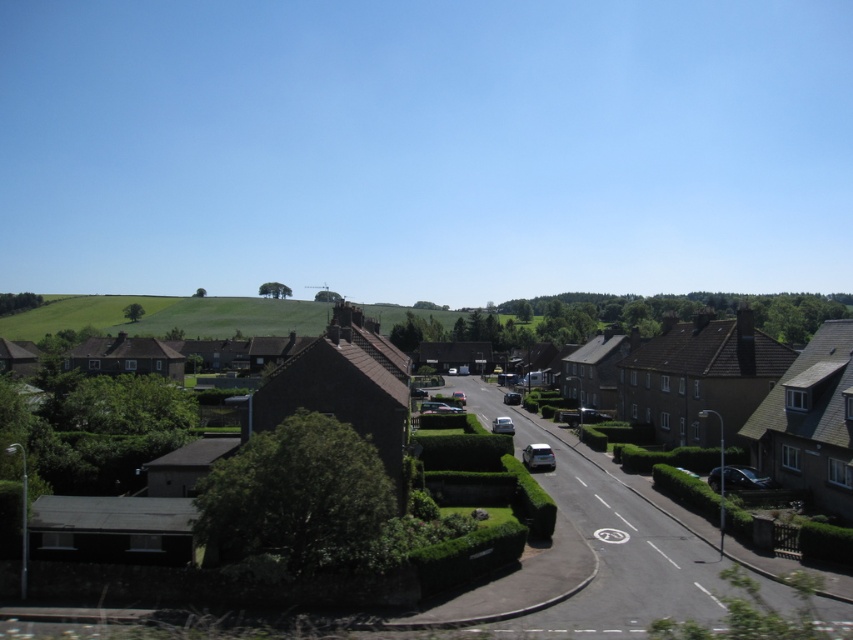
Question: Does brown brick houses at center appear on the right side of green leafy hedge at center?

Choices:
 (A) no
 (B) yes

Answer: (B)

Question: Does brown brick houses at center lie behind green leafy hedge at center?

Choices:
 (A) yes
 (B) no

Answer: (B)

Question: Estimate the real-world distances between objects in this image. Which object is farther from the green grassy hillside at center?

Choices:
 (A) brown brick houses at center
 (B) green leafy hedge at center

Answer: (B)

Question: Is brown brick houses at center closer to the viewer compared to green leafy hedge at center?

Choices:
 (A) no
 (B) yes

Answer: (B)

Question: Which of the following is the closest to the observer?

Choices:
 (A) brown brick houses at center
 (B) green leafy hedge at center

Answer: (A)

Question: Which object is farther from the camera taking this photo?

Choices:
 (A) green grassy hillside at center
 (B) green leafy hedge at center

Answer: (A)